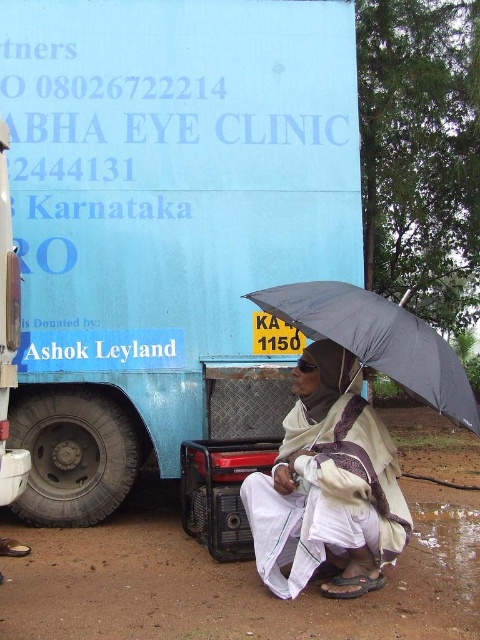
Can you confirm if white cotton robe at lower center is positioned to the left of black matte umbrella at lower right?

Yes, white cotton robe at lower center is to the left of black matte umbrella at lower right.

Consider the image. Who is positioned more to the left, white cotton robe at lower center or black matte umbrella at lower right?

white cotton robe at lower center is more to the left.

Locate an element on the screen. Image resolution: width=480 pixels, height=640 pixels. white cotton robe at lower center is located at coordinates (327, 484).

Can you confirm if blue matte truck at center is smaller than white cotton robe at lower center?

Incorrect, blue matte truck at center is not smaller in size than white cotton robe at lower center.

Which is above, blue matte truck at center or white cotton robe at lower center?

blue matte truck at center is higher up.

Which is in front, point (155, 412) or point (295, 563)?

Positioned in front is point (295, 563).

I want to click on blue matte truck at center, so click(167, 224).

Does blue matte truck at center have a greater width compared to black matte umbrella at lower right?

Yes.

Is blue matte truck at center further to camera compared to black matte umbrella at lower right?

Yes, it is.

The image size is (480, 640). I want to click on blue matte truck at center, so click(167, 224).